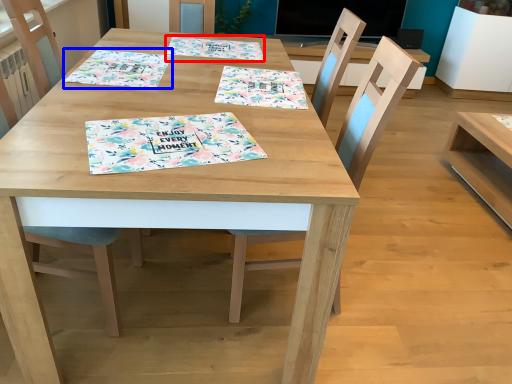
Question: Which of the following is the farthest to the observer, tablecloth (highlighted by a red box) or tablecloth (highlighted by a blue box)?

Choices:
 (A) tablecloth
 (B) tablecloth

Answer: (A)